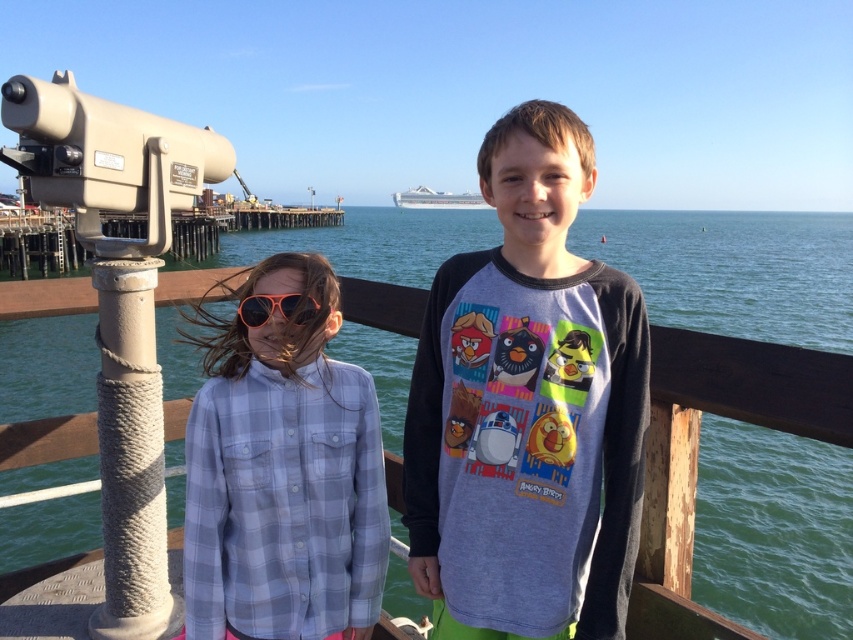
Is point (126, 172) behind point (416, 196)?

No, it is in front of (416, 196).

Can you confirm if beige rope-wrapped telescope at left is positioned to the left of white glossy boat at center?

Correct, you'll find beige rope-wrapped telescope at left to the left of white glossy boat at center.

Image resolution: width=853 pixels, height=640 pixels. What do you see at coordinates (119, 301) in the screenshot? I see `beige rope-wrapped telescope at left` at bounding box center [119, 301].

In order to click on beige rope-wrapped telescope at left in this screenshot , I will do `click(119, 301)`.

Between gray cotton shirt at center and orange reflective sunglasses at center, which one has more height?

With more height is gray cotton shirt at center.

Does point (445, 381) come behind point (242, 304)?

Yes, it is.

This screenshot has height=640, width=853. I want to click on gray cotton shirt at center, so click(x=527, y=408).

Does plaid flannel shirt at center have a lesser width compared to beige rope-wrapped telescope at left?

Incorrect, plaid flannel shirt at center's width is not less than beige rope-wrapped telescope at left's.

Can you confirm if plaid flannel shirt at center is positioned to the left of beige rope-wrapped telescope at left?

Incorrect, plaid flannel shirt at center is not on the left side of beige rope-wrapped telescope at left.

Based on the photo, who is more distant from viewer, (256, 467) or (141, 426)?

The point (141, 426) is behind.

What are the coordinates of `plaid flannel shirt at center` in the screenshot? It's located at (282, 474).